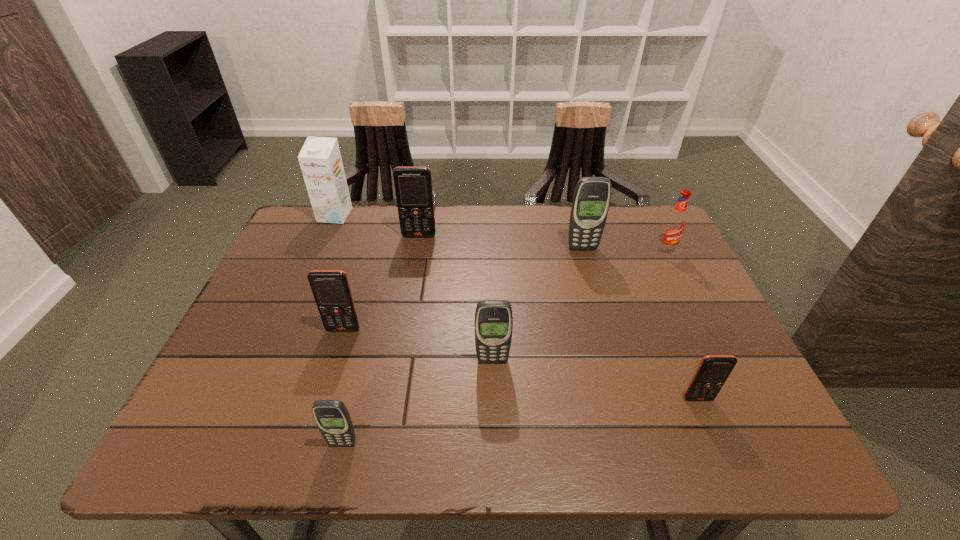
Find the location of a particular element. The height and width of the screenshot is (540, 960). vacant space located on the screen of the fourth farthest cellular telephone is located at coordinates (x=493, y=396).

At what (x,y) coordinates should I click in order to perform the action: click on blank area located on the screen of the fourth nearest object. Please return your answer as a coordinate pair (x, y). Image resolution: width=960 pixels, height=540 pixels. Looking at the image, I should click on (318, 414).

This screenshot has height=540, width=960. What are the coordinates of `vacant space situated on the screen of the second nearest object` in the screenshot? It's located at (713, 434).

At what (x,y) coordinates should I click in order to perform the action: click on carton that is at the far edge. Please return your answer as a coordinate pair (x, y). Looking at the image, I should click on (320, 160).

In order to click on root beer that is at the far edge in this screenshot , I will do `click(674, 225)`.

This screenshot has width=960, height=540. I want to click on object that is at the near edge, so click(x=333, y=420).

Locate an element on the screen. Image resolution: width=960 pixels, height=540 pixels. object positioned at the left edge is located at coordinates (320, 160).

Where is `root beer present at the right edge`? This screenshot has height=540, width=960. root beer present at the right edge is located at coordinates coord(674,225).

You are a GUI agent. You are given a task and a screenshot of the screen. Output one action in this format:
    pyautogui.click(x=<x>, y=<y>)
    Task: Click on the cellular telephone that is at the right edge
    
    Given the screenshot: What is the action you would take?
    pyautogui.click(x=713, y=370)

Find the location of a particular element. object that is at the far left corner is located at coordinates (320, 160).